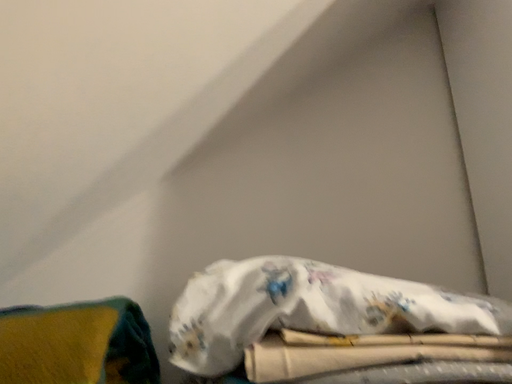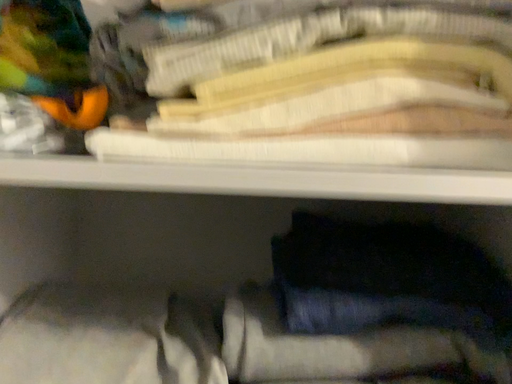
Question: How did the camera likely rotate when shooting the video?

Choices:
 (A) rotated upward
 (B) rotated downward

Answer: (B)